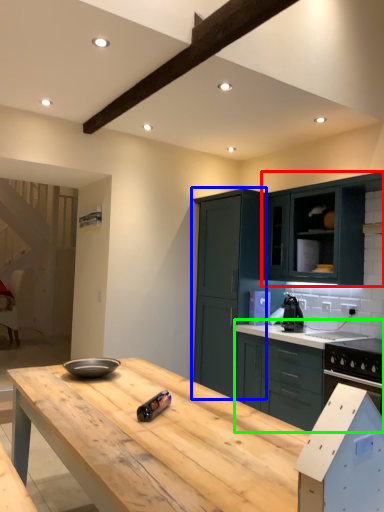
Question: Which is nearer to the cabinetry (highlighted by a red box)? cabinetry (highlighted by a blue box) or cabinetry (highlighted by a green box).

Choices:
 (A) cabinetry
 (B) cabinetry

Answer: (A)